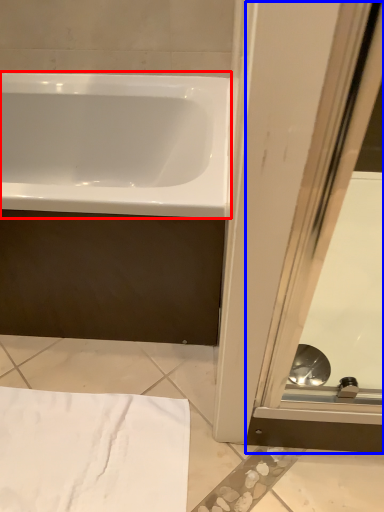
Question: Which point is closer to the camera, bathtub (highlighted by a red box) or screen door (highlighted by a blue box)?

Choices:
 (A) bathtub
 (B) screen door

Answer: (A)